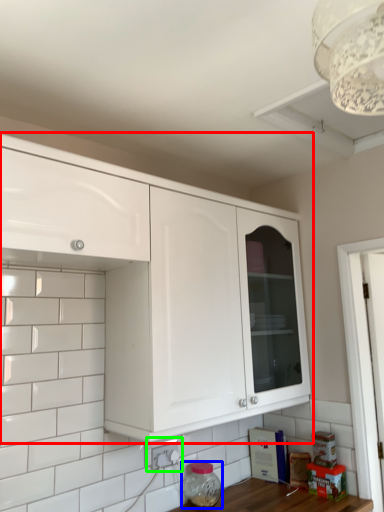
Question: Which is nearer to the cabinetry (highlighted by a red box)? appliance (highlighted by a blue box) or electric outlet (highlighted by a green box).

Choices:
 (A) appliance
 (B) electric outlet

Answer: (B)